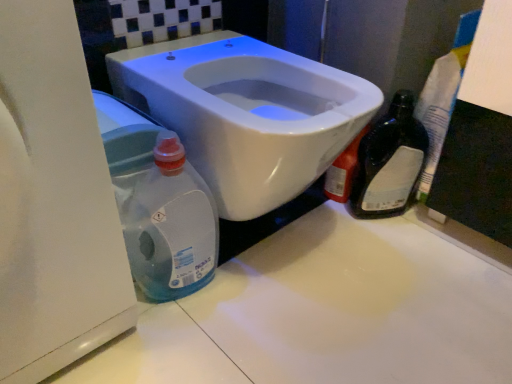
In order to click on vacant area that lies to the right of white glossy toilet at center in this screenshot , I will do `click(418, 266)`.